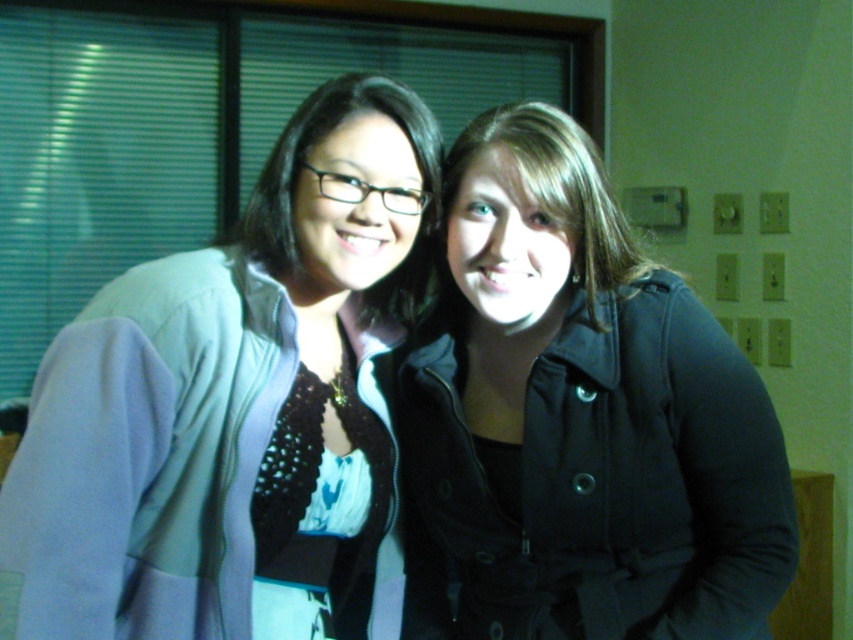
Question: Is matte black jacket at center positioned at the back of matte black glasses at center?

Choices:
 (A) no
 (B) yes

Answer: (B)

Question: Which point is closer to the camera?

Choices:
 (A) (67, 477)
 (B) (695, 428)
 (C) (415, 106)

Answer: (A)

Question: Is matte black jacket at center to the left of matte black glasses at center from the viewer's perspective?

Choices:
 (A) yes
 (B) no

Answer: (B)

Question: Can you confirm if matte purple jacket at left is positioned below matte black jacket at center?

Choices:
 (A) no
 (B) yes

Answer: (A)

Question: Which of the following is the closest to the observer?

Choices:
 (A) matte black glasses at center
 (B) matte black jacket at center
 (C) matte purple jacket at left

Answer: (C)

Question: Which object is closer to the camera taking this photo?

Choices:
 (A) matte purple jacket at left
 (B) matte black glasses at center

Answer: (A)